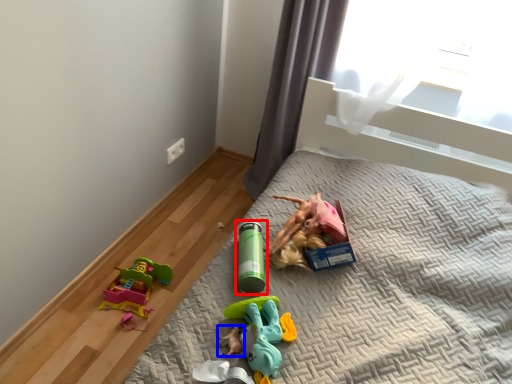
Question: Which of the following is the closest to the observer, toy (highlighted by a red box) or toy (highlighted by a blue box)?

Choices:
 (A) toy
 (B) toy

Answer: (B)